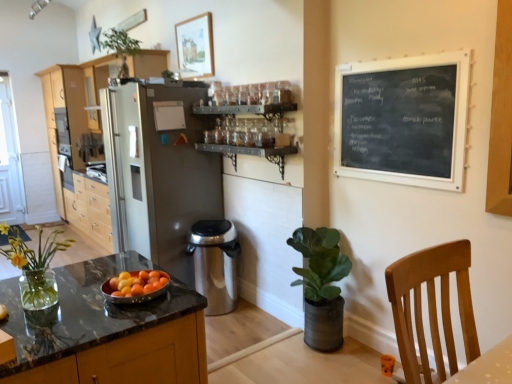
Question: In terms of size, does green leafy plant at upper center, placed as the 3th houseplant when sorted from right to left, appear bigger or smaller than satin silver refrigerator at center?

Choices:
 (A) big
 (B) small

Answer: (B)

Question: From the image's perspective, is green leafy plant at upper center, the first houseplant in the back-to-front sequence, located above or below satin silver refrigerator at center?

Choices:
 (A) above
 (B) below

Answer: (A)

Question: Based on their relative distances, which object is nearer to the light brown wood cabinets at left?

Choices:
 (A) metallic bowl of fruit at center
 (B) black chalkboard at upper right
 (C) light brown wooden chair at lower right
 (D) green matte plant at lower right, positioned as the 1th houseplant in bottom-to-top order
 (E) white painted wood screen door at left

Answer: (E)

Question: Which of these objects is positioned farthest from the satin silver refrigerator at center?

Choices:
 (A) wooden picture frame at upper center
 (B) black chalkboard at upper right
 (C) green matte plant at lower right, positioned as the 1th houseplant in bottom-to-top order
 (D) light brown wood cabinets at left
 (E) white painted wood screen door at left

Answer: (E)